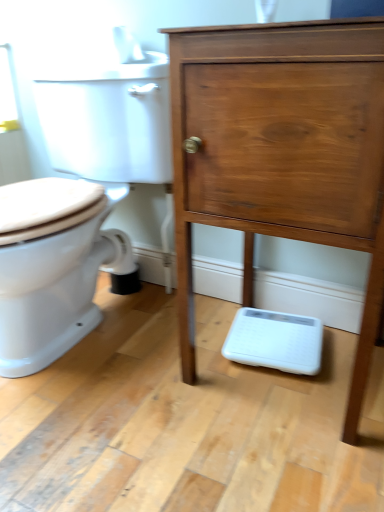
Question: From the image's perspective, is white glossy toilet at left positioned above or below matte wood chest of drawers at center?

Choices:
 (A) below
 (B) above

Answer: (B)

Question: Considering the positions of white glossy toilet at left and matte wood chest of drawers at center in the image, is white glossy toilet at left bigger or smaller than matte wood chest of drawers at center?

Choices:
 (A) big
 (B) small

Answer: (A)

Question: Considering the positions of white glossy toilet at left and matte wood chest of drawers at center in the image, is white glossy toilet at left wider or thinner than matte wood chest of drawers at center?

Choices:
 (A) wide
 (B) thin

Answer: (A)

Question: Considering the positions of matte wood chest of drawers at center and white glossy toilet at left in the image, is matte wood chest of drawers at center wider or thinner than white glossy toilet at left?

Choices:
 (A) wide
 (B) thin

Answer: (B)

Question: From the image's perspective, relative to white glossy toilet at left, is matte wood chest of drawers at center above or below?

Choices:
 (A) above
 (B) below

Answer: (B)

Question: Considering the positions of matte wood chest of drawers at center and white glossy toilet at left in the image, is matte wood chest of drawers at center bigger or smaller than white glossy toilet at left?

Choices:
 (A) big
 (B) small

Answer: (B)

Question: Based on their positions, is matte wood chest of drawers at center located to the left or right of white glossy toilet at left?

Choices:
 (A) right
 (B) left

Answer: (A)